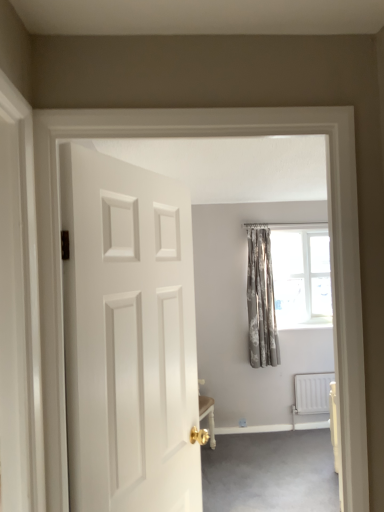
Where is `empty space that is ontop of carpet at lower right (from a real-world perspective)`? empty space that is ontop of carpet at lower right (from a real-world perspective) is located at coordinates (270, 460).